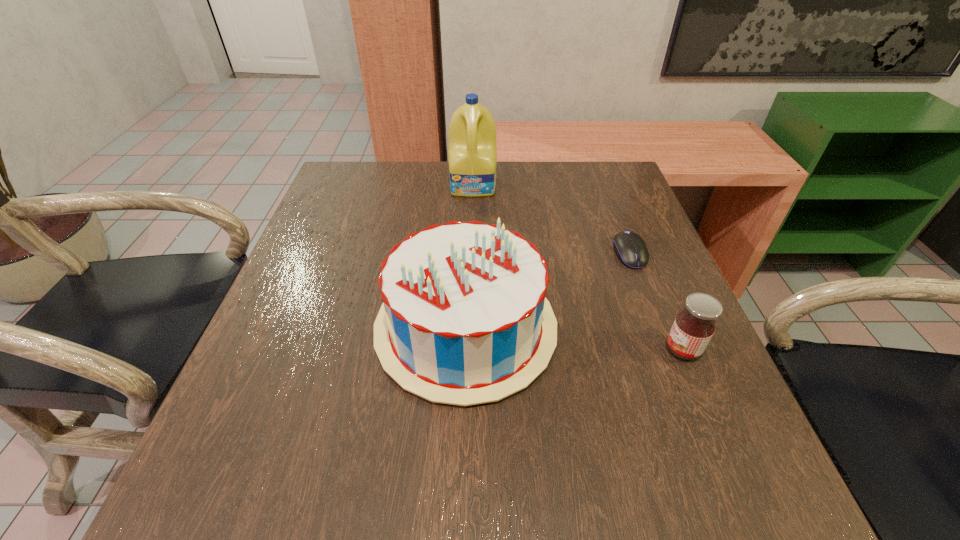
I want to click on vacant region located 0.390m on the front of the shortest object, so click(x=703, y=444).

You are a GUI agent. You are given a task and a screenshot of the screen. Output one action in this format:
    pyautogui.click(x=<x>, y=<y>)
    Task: Click on the object situated at the far edge
    
    Given the screenshot: What is the action you would take?
    pyautogui.click(x=472, y=152)

The image size is (960, 540). In order to click on jam at the right edge in this screenshot , I will do `click(694, 326)`.

This screenshot has width=960, height=540. I want to click on computer mouse that is at the right edge, so click(x=630, y=248).

Where is `free spot at the far edge of the desktop`? The height and width of the screenshot is (540, 960). free spot at the far edge of the desktop is located at coordinates (503, 198).

In the image, there is a desktop. What are the coordinates of `free space at the near edge` in the screenshot? It's located at (367, 492).

You are a GUI agent. You are given a task and a screenshot of the screen. Output one action in this format:
    pyautogui.click(x=<x>, y=<y>)
    Task: Click on the free space at the left edge of the desktop
    
    Given the screenshot: What is the action you would take?
    pyautogui.click(x=309, y=310)

In the image, there is a desktop. Identify the location of vacant space at the right edge. The image size is (960, 540). (678, 375).

Where is `free space at the far right corner of the desktop`? The width and height of the screenshot is (960, 540). free space at the far right corner of the desktop is located at coordinates (636, 196).

Image resolution: width=960 pixels, height=540 pixels. I want to click on free space that is in between the second tallest object and the computer mouse, so click(547, 291).